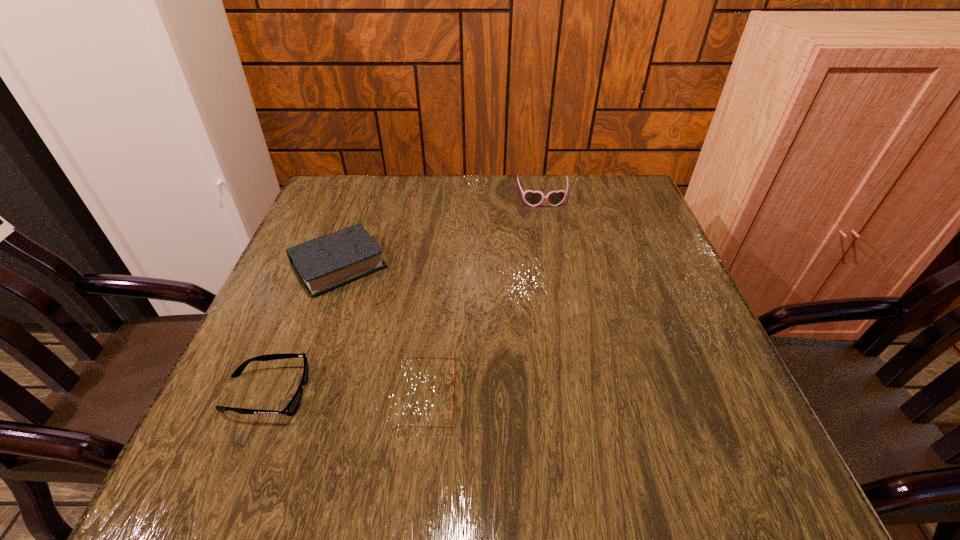
Locate an element on the screen. The width and height of the screenshot is (960, 540). Bible located at the left edge is located at coordinates (324, 263).

At what (x,y) coordinates should I click in order to perform the action: click on sunglasses at the left edge. Please return your answer as a coordinate pair (x, y). The image size is (960, 540). Looking at the image, I should click on (290, 409).

Where is `free space at the far edge of the desktop`? free space at the far edge of the desktop is located at coordinates (499, 174).

You are a GUI agent. You are given a task and a screenshot of the screen. Output one action in this format:
    pyautogui.click(x=<x>, y=<y>)
    Task: Click on the vacant space at the near edge of the desktop
    The height and width of the screenshot is (540, 960).
    Given the screenshot: What is the action you would take?
    pyautogui.click(x=446, y=466)

Find the location of `vacant space at the left edge of the desktop`. vacant space at the left edge of the desktop is located at coordinates (301, 312).

The width and height of the screenshot is (960, 540). In order to click on vacant space at the right edge in this screenshot , I will do pos(632,292).

Identify the location of blank space at the far left corner. (370, 175).

Identify the location of free space at the near left corner of the desktop. This screenshot has width=960, height=540. (273, 448).

In the image, there is a desktop. Find the location of `vacant space at the far right corner`. vacant space at the far right corner is located at coordinates (646, 221).

Find the location of a particular element. The height and width of the screenshot is (540, 960). vacant area at the near right corner is located at coordinates (710, 440).